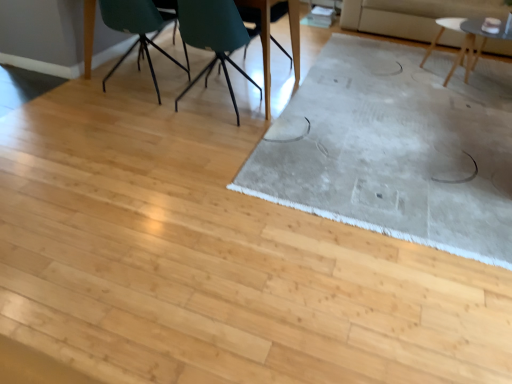
Question: Does teal plastic chair at upper center, the second chair in the right-to-left sequence, appear on the right side of light gray textured rug at center?

Choices:
 (A) yes
 (B) no

Answer: (B)

Question: Considering the relative sizes of teal plastic chair at upper center, the second chair in the right-to-left sequence, and light gray textured rug at center in the image provided, is teal plastic chair at upper center, the second chair in the right-to-left sequence, taller than light gray textured rug at center?

Choices:
 (A) yes
 (B) no

Answer: (A)

Question: Would you say teal plastic chair at upper center, the second chair in the right-to-left sequence, is outside light gray textured rug at center?

Choices:
 (A) no
 (B) yes

Answer: (B)

Question: Is teal plastic chair at upper center, which ranks as the 2th chair in left-to-right order, oriented away from light gray textured rug at center?

Choices:
 (A) no
 (B) yes

Answer: (A)

Question: From the image's perspective, is teal plastic chair at upper center, which ranks as the 2th chair in left-to-right order, located beneath light gray textured rug at center?

Choices:
 (A) yes
 (B) no

Answer: (B)

Question: From a real-world perspective, is teal plastic chair at upper center, which ranks as the 2th chair in left-to-right order, physically below light gray textured rug at center?

Choices:
 (A) no
 (B) yes

Answer: (A)

Question: From a real-world perspective, is wooden chair at center, positioned as the third chair in left-to-right order, physically below light gray textured rug at center?

Choices:
 (A) no
 (B) yes

Answer: (A)

Question: From the image's perspective, is wooden chair at center, which is the first chair in right-to-left order, above light gray textured rug at center?

Choices:
 (A) no
 (B) yes

Answer: (B)

Question: From a real-world perspective, is wooden chair at center, positioned as the third chair in left-to-right order, located higher than light gray textured rug at center?

Choices:
 (A) no
 (B) yes

Answer: (B)

Question: Is wooden chair at center, which is the first chair in right-to-left order, to the left of light gray textured rug at center from the viewer's perspective?

Choices:
 (A) yes
 (B) no

Answer: (A)

Question: From the image's perspective, is wooden chair at center, positioned as the third chair in left-to-right order, below light gray textured rug at center?

Choices:
 (A) yes
 (B) no

Answer: (B)

Question: Is wooden chair at center, which is the first chair in right-to-left order, oriented towards light gray textured rug at center?

Choices:
 (A) no
 (B) yes

Answer: (A)

Question: Does teal plastic chair at upper center, which ranks as the 2th chair in left-to-right order, contain matte wood table at upper center, acting as the first table starting from the left?

Choices:
 (A) no
 (B) yes

Answer: (A)